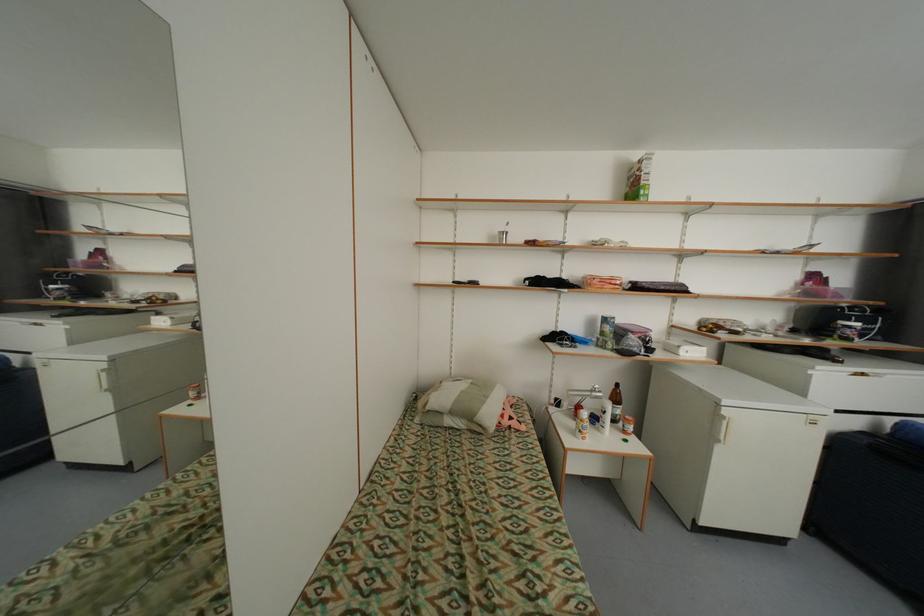
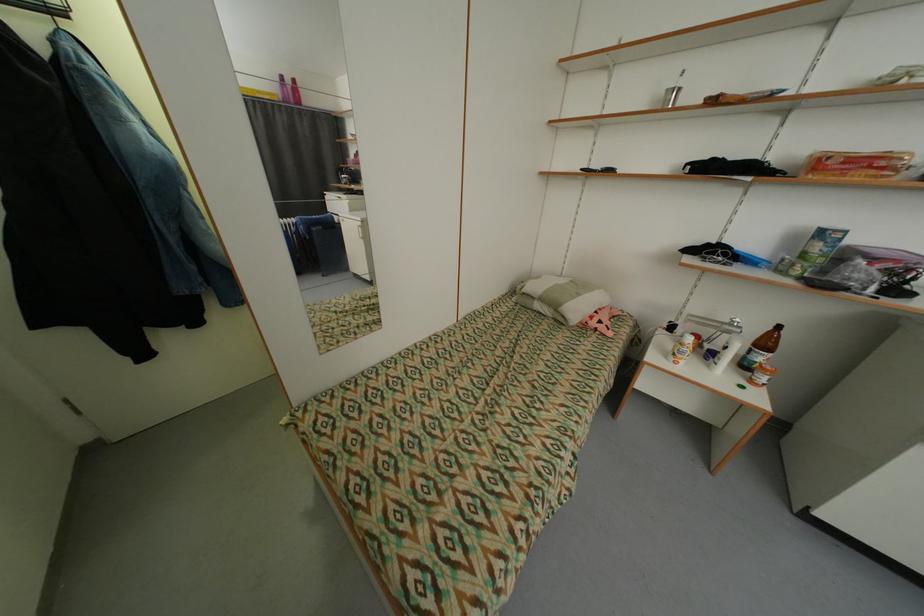
The point at (512, 423) is marked in the first image. Where is the corresponding point in the second image?

(600, 323)